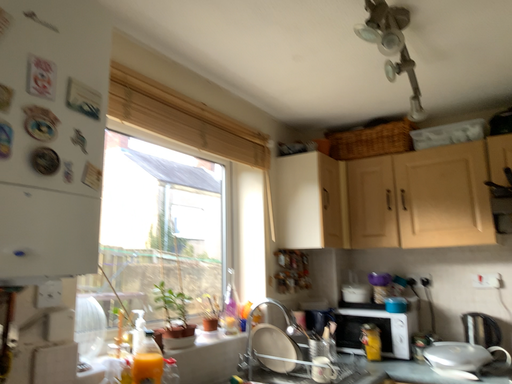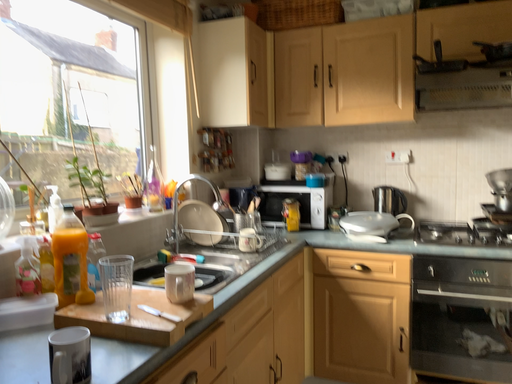
Question: Which way did the camera rotate in the video?

Choices:
 (A) rotated left
 (B) rotated right

Answer: (B)